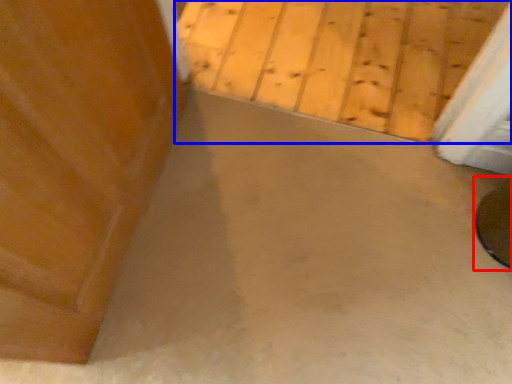
Question: Among these objects, which one is nearest to the camera, round table (highlighted by a red box) or concrete (highlighted by a blue box)?

Choices:
 (A) round table
 (B) concrete

Answer: (A)